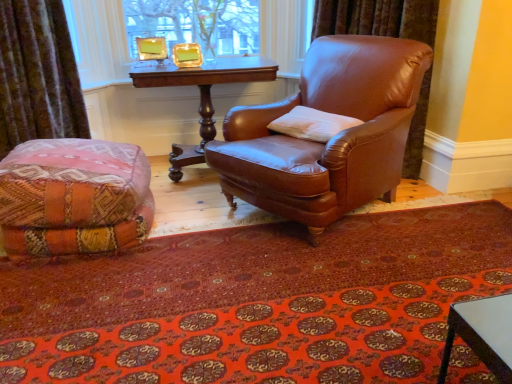
Question: Can you confirm if carpeted mat at lower center is positioned to the left of mahogany wood table at center?

Choices:
 (A) yes
 (B) no

Answer: (B)

Question: Is carpeted mat at lower center facing away from mahogany wood table at center?

Choices:
 (A) no
 (B) yes

Answer: (A)

Question: From the image's perspective, would you say carpeted mat at lower center is positioned over mahogany wood table at center?

Choices:
 (A) no
 (B) yes

Answer: (A)

Question: From the image's perspective, is carpeted mat at lower center below mahogany wood table at center?

Choices:
 (A) no
 (B) yes

Answer: (B)

Question: Does carpeted mat at lower center have a greater height compared to mahogany wood table at center?

Choices:
 (A) no
 (B) yes

Answer: (A)

Question: In the image, is brown leather chair at center positioned in front of or behind carpeted mat at lower center?

Choices:
 (A) front
 (B) behind

Answer: (B)

Question: Is brown leather chair at center spatially inside carpeted mat at lower center, or outside of it?

Choices:
 (A) outside
 (B) inside

Answer: (A)

Question: Is brown leather chair at center taller or shorter than carpeted mat at lower center?

Choices:
 (A) tall
 (B) short

Answer: (A)

Question: Looking at their shapes, would you say brown leather chair at center is wider or thinner than carpeted mat at lower center?

Choices:
 (A) thin
 (B) wide

Answer: (A)

Question: In the image, is velvet brown curtain at lower left positioned in front of or behind white soft pillow at center?

Choices:
 (A) behind
 (B) front

Answer: (B)

Question: From the image's perspective, is velvet brown curtain at lower left above or below white soft pillow at center?

Choices:
 (A) above
 (B) below

Answer: (A)

Question: Looking at the image, does velvet brown curtain at lower left seem bigger or smaller compared to white soft pillow at center?

Choices:
 (A) big
 (B) small

Answer: (A)

Question: Is point (24, 21) positioned closer to the camera than point (294, 109)?

Choices:
 (A) farther
 (B) closer

Answer: (B)

Question: Relative to gold-framed picture at upper center, is velvet brown curtain at lower left in front or behind?

Choices:
 (A) behind
 (B) front

Answer: (B)

Question: Considering the positions of point (57, 82) and point (146, 29), is point (57, 82) closer or farther from the camera than point (146, 29)?

Choices:
 (A) farther
 (B) closer

Answer: (B)